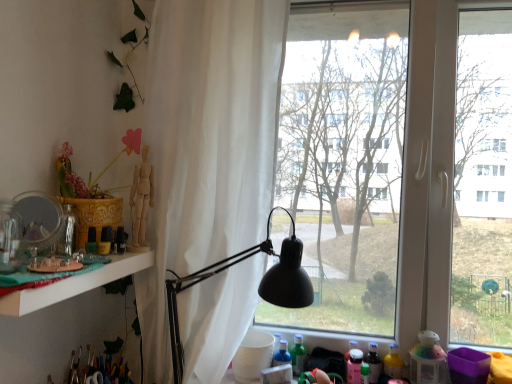
Image resolution: width=512 pixels, height=384 pixels. I want to click on free space between matte silver mirror at left and wooden mannequin at left, so click(93, 257).